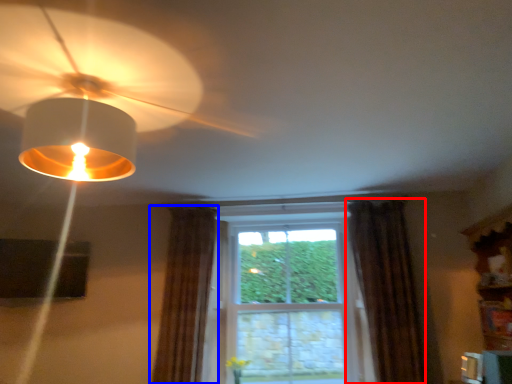
Question: Which point is closer to the camera, curtain (highlighted by a red box) or curtain (highlighted by a blue box)?

Choices:
 (A) curtain
 (B) curtain

Answer: (A)